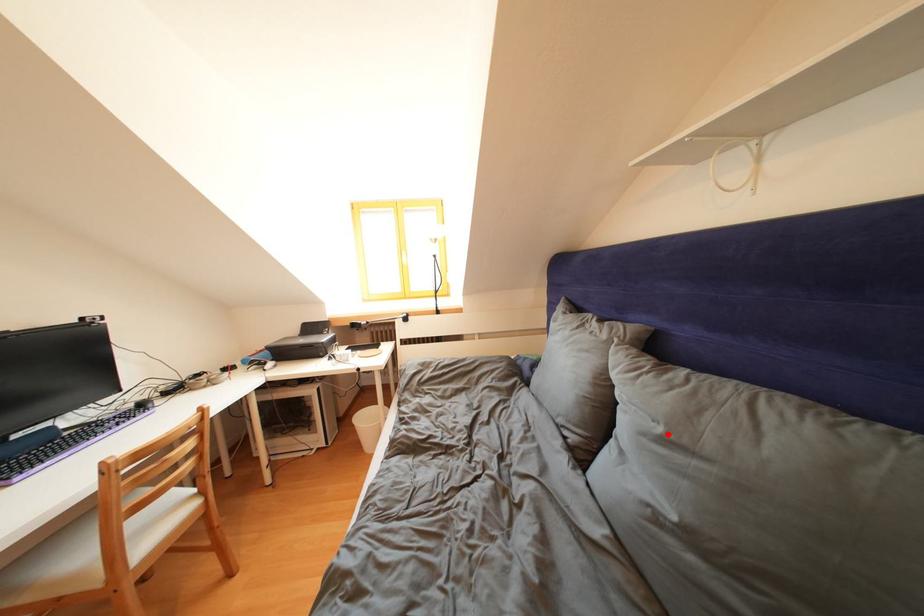
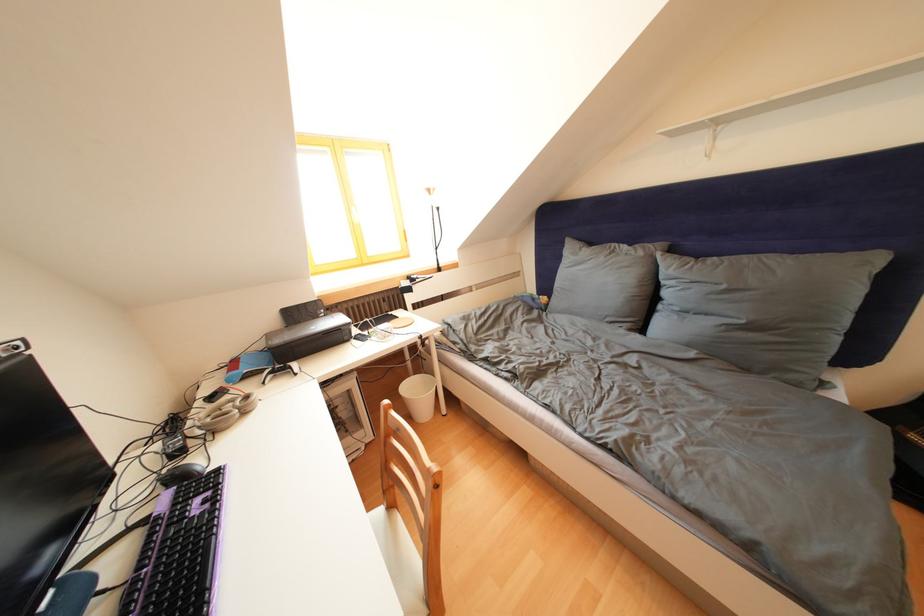
In the second image, find the point that corresponds to the highlighted location in the first image.

(733, 292)